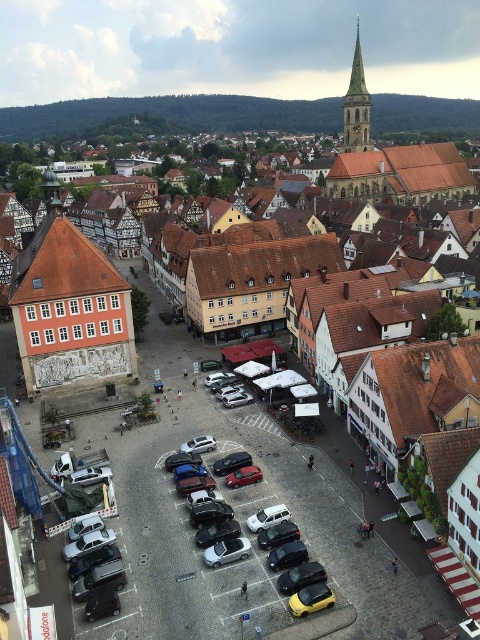
Question: Where is smooth stone spire at upper center located in relation to metallic silver car at center in the image?

Choices:
 (A) right
 (B) left

Answer: (A)

Question: Estimate the real-world distances between objects in this image. Which object is closer to the shiny black sedan at center?

Choices:
 (A) metallic silver car at center
 (B) shiny black car at center
 (C) metallic gray sedan at center
 (D) metallic yellow car at center

Answer: (C)

Question: Is yellow matte car at lower center below shiny black sedan at center?

Choices:
 (A) no
 (B) yes

Answer: (B)

Question: Estimate the real-world distances between objects in this image. Which object is farther from the shiny black car at center?

Choices:
 (A) shiny metallic car at center
 (B) smooth stone spire at upper center
 (C) shiny black sedan at center
 (D) metallic cars at center

Answer: (B)

Question: Does shiny black car at center appear under shiny black sedan at center?

Choices:
 (A) no
 (B) yes

Answer: (B)

Question: Estimate the real-world distances between objects in this image. Which object is closer to the metallic gray sedan at center?

Choices:
 (A) metallic yellow car at center
 (B) smooth stone spire at upper center
 (C) metallic silver car at center
 (D) metallic cars at center

Answer: (D)